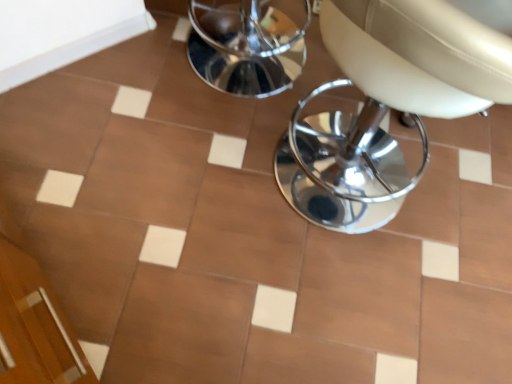
Question: Does white leather chair at center have a greater height compared to white glossy tile at upper left?

Choices:
 (A) yes
 (B) no

Answer: (A)

Question: Is white leather chair at center to the right of white glossy tile at upper left from the viewer's perspective?

Choices:
 (A) no
 (B) yes

Answer: (B)

Question: Is white leather chair at center facing away from white glossy tile at upper left?

Choices:
 (A) yes
 (B) no

Answer: (B)

Question: Would you say white leather chair at center is a long distance from white glossy tile at upper left?

Choices:
 (A) no
 (B) yes

Answer: (A)

Question: From a real-world perspective, is white leather chair at center below white glossy tile at upper left?

Choices:
 (A) yes
 (B) no

Answer: (B)

Question: From the image's perspective, is white leather chair at center below white glossy tile at upper left?

Choices:
 (A) yes
 (B) no

Answer: (A)

Question: Can you confirm if white glossy tile at upper left is positioned to the right of white leather chair at center?

Choices:
 (A) no
 (B) yes

Answer: (A)

Question: From a real-world perspective, is white glossy tile at upper left on white leather chair at center?

Choices:
 (A) no
 (B) yes

Answer: (A)

Question: Is white glossy tile at upper left oriented away from white leather chair at center?

Choices:
 (A) yes
 (B) no

Answer: (B)

Question: Is white glossy tile at upper left shorter than white leather chair at center?

Choices:
 (A) no
 (B) yes

Answer: (B)

Question: Is white glossy tile at upper left taller than white leather chair at center?

Choices:
 (A) yes
 (B) no

Answer: (B)

Question: Does white glossy tile at upper left come in front of white leather chair at center?

Choices:
 (A) no
 (B) yes

Answer: (A)

Question: Looking at the image, does white leather chair at center seem bigger or smaller compared to white glossy tile at upper left?

Choices:
 (A) big
 (B) small

Answer: (A)